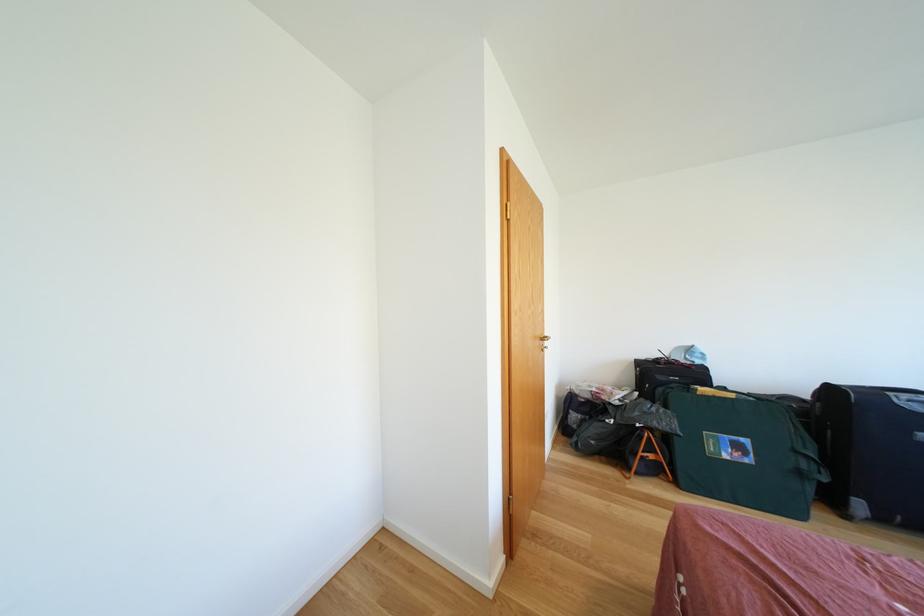
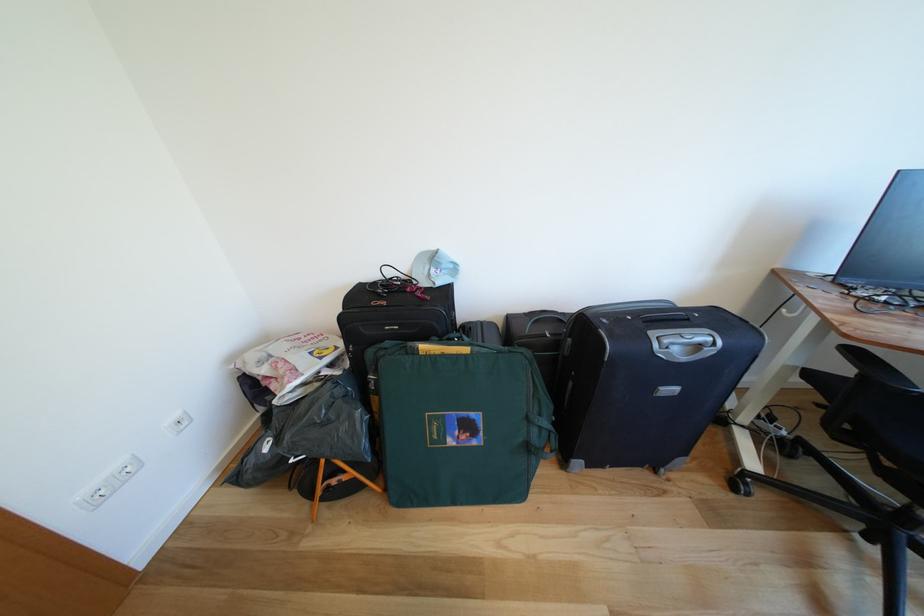
Find the pixel in the second image that matches (x=698, y=354) in the first image.

(442, 262)